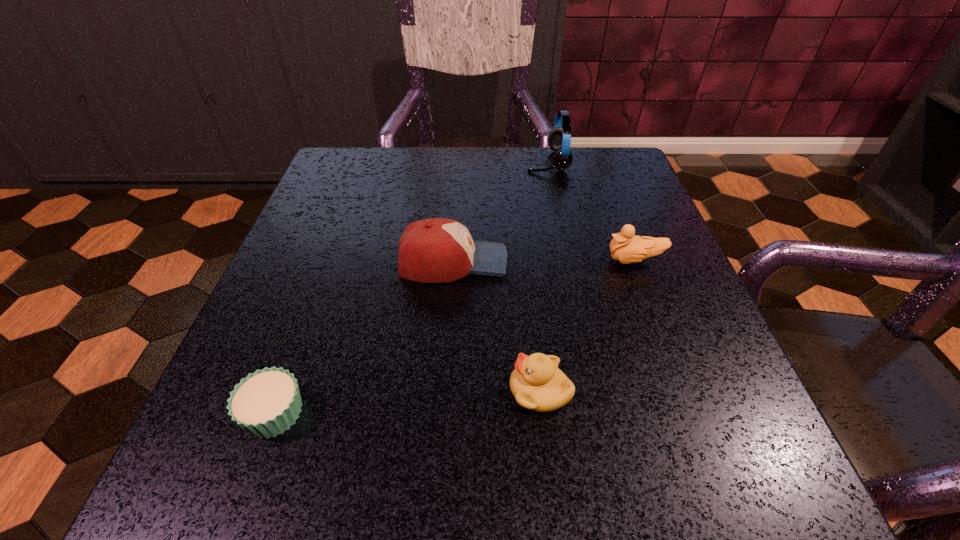
Image resolution: width=960 pixels, height=540 pixels. I want to click on free spot between the nearer duckling and the farther duckling, so click(588, 326).

Identify which object is the closest to the left duckling. Please provide its 2D coordinates. Your answer should be formatted as a tuple, i.e. [(x, y)], where the tuple contains the x and y coordinates of a point satisfying the conditions above.

[(435, 250)]

Locate an element on the screen. This screenshot has height=540, width=960. the second closest object to the nearer duckling is located at coordinates (626, 248).